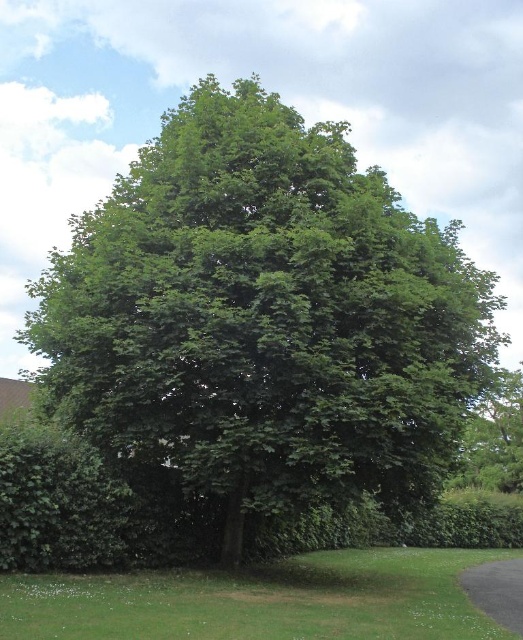
Looking at this image, can you confirm if green leafy tree at center is positioned to the left of black asphalt driveway at lower right?

Indeed, green leafy tree at center is positioned on the left side of black asphalt driveway at lower right.

Between point (232, 113) and point (492, 598), which one is positioned behind?

Positioned behind is point (232, 113).

Which is behind, point (79, 371) or point (487, 566)?

The point (487, 566) is behind.

Where is `green leafy tree at center`? Image resolution: width=523 pixels, height=640 pixels. green leafy tree at center is located at coordinates (262, 324).